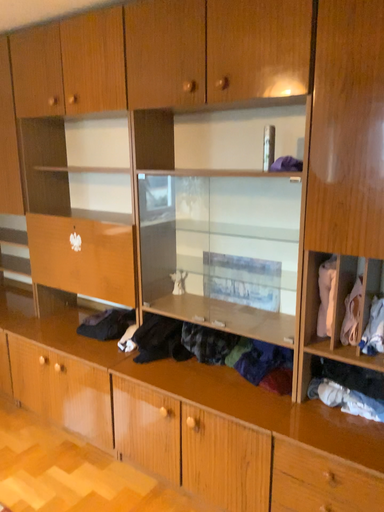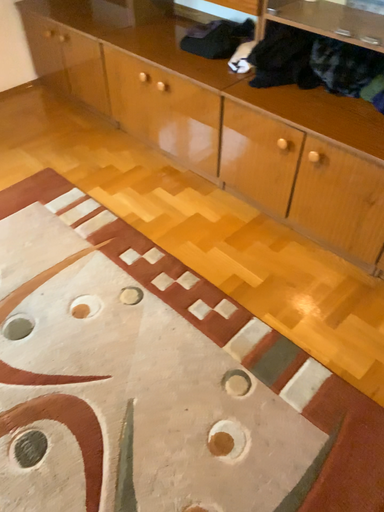
Question: Which way did the camera rotate in the video?

Choices:
 (A) rotated left
 (B) rotated right

Answer: (A)